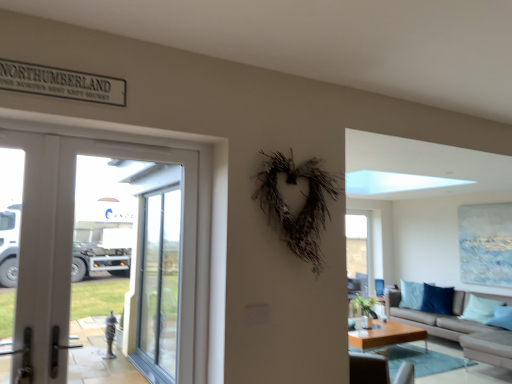
The height and width of the screenshot is (384, 512). What do you see at coordinates (159, 285) in the screenshot?
I see `clear glass screen door at center, which appears as the 2th screen door when viewed from the front` at bounding box center [159, 285].

Identify the location of transparent glass window at center. Image resolution: width=512 pixels, height=384 pixels. (360, 250).

What do you see at coordinates (379, 287) in the screenshot?
I see `blue fabric armchair at right` at bounding box center [379, 287].

Image resolution: width=512 pixels, height=384 pixels. What are the coordinates of `white glossy door at left` in the screenshot? It's located at (100, 249).

Image resolution: width=512 pixels, height=384 pixels. What do you see at coordinates (385, 335) in the screenshot?
I see `light brown wooden coffee table at lower center` at bounding box center [385, 335].

You are a GUI agent. You are given a task and a screenshot of the screen. Output one action in this format:
    pyautogui.click(x=<x>, y=<y>)
    Task: Click on the light brown wooden coffee table at lower center
    This screenshot has width=512, height=384.
    Given the screenshot: What is the action you would take?
    pyautogui.click(x=385, y=335)

What is the approximate width of light blue fabric pillow at lower right?

light blue fabric pillow at lower right is 12.41 inches wide.

Find the location of `clear glass screen door at center, acting as the 1th screen door starting from the back`. clear glass screen door at center, acting as the 1th screen door starting from the back is located at coordinates (159, 285).

Find the location of a particular element. coffee table beneath the beige fabric couch at lower right (from a real-world perspective) is located at coordinates (385, 335).

From the image's perspective, is beige fabric couch at lower right beneath light brown wooden coffee table at lower center?

Incorrect, from the image's perspective, beige fabric couch at lower right is higher than light brown wooden coffee table at lower center.

Between beige fabric couch at lower right and light brown wooden coffee table at lower center, which one is positioned in front?

light brown wooden coffee table at lower center is closer to the camera.

Is beige fabric couch at lower right oriented towards light brown wooden coffee table at lower center?

Yes, beige fabric couch at lower right is aimed at light brown wooden coffee table at lower center.

Is clear glass screen door at center, acting as the 1th screen door starting from the back, bigger than white glossy screen door at left, the 1th screen door in the front-to-back sequence?

Indeed, clear glass screen door at center, acting as the 1th screen door starting from the back, has a larger size compared to white glossy screen door at left, the 1th screen door in the front-to-back sequence.

Where is `screen door in front of the clear glass screen door at center, acting as the 1th screen door starting from the back`? The width and height of the screenshot is (512, 384). screen door in front of the clear glass screen door at center, acting as the 1th screen door starting from the back is located at coordinates (45, 252).

Could you tell me if clear glass screen door at center, which appears as the 2th screen door when viewed from the front, is facing white glossy screen door at left, which is counted as the 2th screen door, starting from the back?

No, clear glass screen door at center, which appears as the 2th screen door when viewed from the front, is not aimed at white glossy screen door at left, which is counted as the 2th screen door, starting from the back.

In the scene shown: Are clear glass screen door at center, acting as the 1th screen door starting from the back, and white glossy screen door at left, the 1th screen door in the front-to-back sequence, located far from each other?

Yes, clear glass screen door at center, acting as the 1th screen door starting from the back, and white glossy screen door at left, the 1th screen door in the front-to-back sequence, are located far from each other.

From a real-world perspective, is blue fabric armchair at right positioned above or below beige fabric couch at lower right?

From a real-world perspective, blue fabric armchair at right is physically above beige fabric couch at lower right.

Based on the photo, does blue fabric armchair at right come behind beige fabric couch at lower right?

That is True.

Could you tell me if blue fabric armchair at right is facing beige fabric couch at lower right?

Result: No, blue fabric armchair at right is not facing towards beige fabric couch at lower right.

From the image's perspective, is blue fabric armchair at right beneath beige fabric couch at lower right?

Incorrect, from the image's perspective, blue fabric armchair at right is higher than beige fabric couch at lower right.

From the picture: Considering the sizes of objects transparent glass window at center and light blue fabric pillow at lower right in the image provided, who is taller, transparent glass window at center or light blue fabric pillow at lower right?

With more height is transparent glass window at center.

Considering the relative sizes of transparent glass window at center and light blue fabric pillow at lower right in the image provided, is transparent glass window at center thinner than light blue fabric pillow at lower right?

Indeed, transparent glass window at center has a lesser width compared to light blue fabric pillow at lower right.

In the image, is transparent glass window at center positioned in front of or behind light blue fabric pillow at lower right?

Clearly, transparent glass window at center is behind light blue fabric pillow at lower right.

Considering the sizes of light blue fabric pillow at lower right and blue fabric armchair at right in the image, is light blue fabric pillow at lower right bigger or smaller than blue fabric armchair at right?

Clearly, light blue fabric pillow at lower right is larger in size than blue fabric armchair at right.

Which is behind, point (478, 315) or point (378, 283)?

The point (378, 283) is more distant.

From a real-world perspective, is light blue fabric pillow at lower right above or below blue fabric armchair at right?

light blue fabric pillow at lower right is situated lower than blue fabric armchair at right in the real world.

Considering the points (185, 250) and (358, 266), which point is in front, point (185, 250) or point (358, 266)?

The point (185, 250) is closer.

Is white glossy door at left located outside transparent glass window at center?

Yes, white glossy door at left is located beyond the bounds of transparent glass window at center.

Identify the location of window behind the white glossy door at left. (360, 250).

Is white glossy door at left at the right side of transparent glass window at center?

In fact, white glossy door at left is to the left of transparent glass window at center.

Locate an element on the screen. Image resolution: width=512 pixels, height=384 pixels. door above the blue fabric armchair at right (from the image's perspective) is located at coordinates (100, 249).

From a real-world perspective, who is located higher, blue fabric armchair at right or white glossy door at left?

white glossy door at left.

Is blue fabric armchair at right thinner than white glossy door at left?

Incorrect, the width of blue fabric armchair at right is not less than that of white glossy door at left.

Between blue fabric armchair at right and white glossy door at left, which one is positioned behind?

blue fabric armchair at right is more distant.

Image resolution: width=512 pixels, height=384 pixels. In order to click on coffee table in front of the beige fabric couch at lower right in this screenshot , I will do `click(385, 335)`.

Locate an element on the screen. screen door positioned vertically above the clear glass screen door at center, acting as the 1th screen door starting from the back (from a real-world perspective) is located at coordinates (45, 252).

Looking at the image, which one is located closer to light brown wooden coffee table at lower center, transparent glass window at center or clear glass screen door at center, acting as the 1th screen door starting from the back?

transparent glass window at center lies closer to light brown wooden coffee table at lower center than the other object.

Looking at the image, which one is located further to white glossy screen door at left, which is counted as the 2th screen door, starting from the back, light blue fabric pillow at lower right or white glossy door at left?

light blue fabric pillow at lower right is further to white glossy screen door at left, which is counted as the 2th screen door, starting from the back.

Which object lies further to the anchor point light brown wooden coffee table at lower center, clear glass screen door at center, acting as the 1th screen door starting from the back, or transparent glass window at center?

clear glass screen door at center, acting as the 1th screen door starting from the back.

Considering their positions, is blue fabric armchair at right positioned further to light blue fabric pillow at lower right than white glossy door at left?

Among the two, white glossy door at left is located further to light blue fabric pillow at lower right.

Looking at the image, which one is located closer to blue fabric armchair at right, transparent glass window at center or light blue fabric pillow at lower right?

transparent glass window at center.

Considering their positions, is light brown wooden coffee table at lower center positioned closer to clear glass screen door at center, acting as the 1th screen door starting from the back, than beige fabric couch at lower right?

The object closer to clear glass screen door at center, acting as the 1th screen door starting from the back, is light brown wooden coffee table at lower center.

Looking at this image, based on their spatial positions, is white glossy door at left or clear glass screen door at center, acting as the 1th screen door starting from the back, closer to white glossy screen door at left, the 1th screen door in the front-to-back sequence?

The object closer to white glossy screen door at left, the 1th screen door in the front-to-back sequence, is white glossy door at left.

Based on their spatial positions, is white glossy screen door at left, which is counted as the 2th screen door, starting from the back, or light brown wooden coffee table at lower center further from beige fabric couch at lower right?

white glossy screen door at left, which is counted as the 2th screen door, starting from the back, lies further to beige fabric couch at lower right than the other object.

Find the location of a particular element. The height and width of the screenshot is (384, 512). studio couch situated between white glossy door at left and light blue fabric pillow at lower right from left to right is located at coordinates (441, 316).

In order to click on pillow between white glossy screen door at left, which is counted as the 2th screen door, starting from the back, and blue fabric armchair at right, along the z-axis in this screenshot , I will do `click(479, 309)`.

What are the coordinates of `pillow positioned between light brown wooden coffee table at lower center and blue fabric armchair at right from near to far` in the screenshot? It's located at (479, 309).

Where is `coffee table situated between white glossy screen door at left, which is counted as the 2th screen door, starting from the back, and light blue fabric pillow at lower right from left to right`? The height and width of the screenshot is (384, 512). coffee table situated between white glossy screen door at left, which is counted as the 2th screen door, starting from the back, and light blue fabric pillow at lower right from left to right is located at coordinates (385, 335).